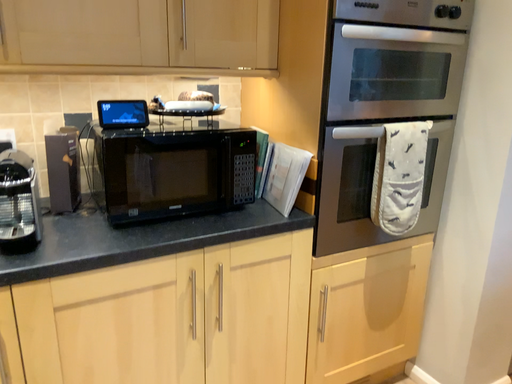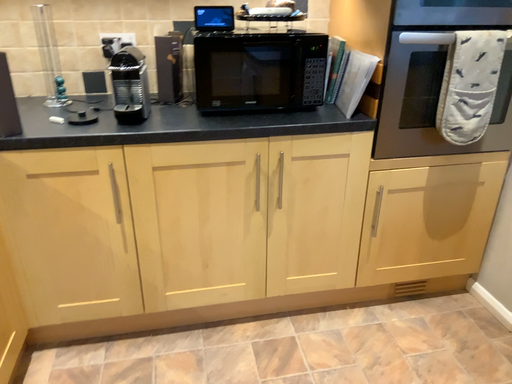
Question: How did the camera likely rotate when shooting the video?

Choices:
 (A) rotated upward
 (B) rotated downward

Answer: (B)